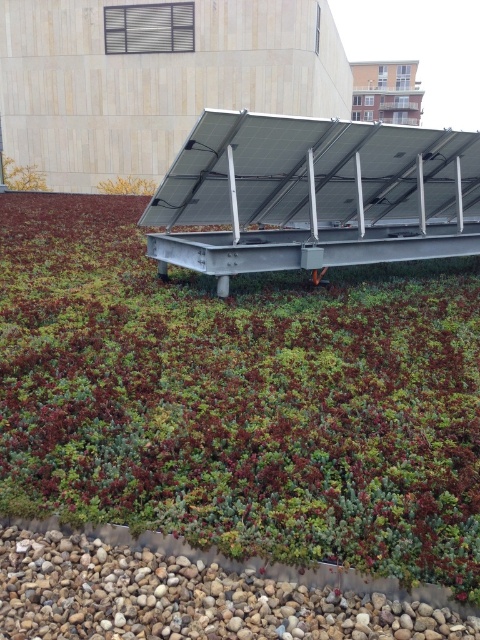
Between green succulent at center and transparent glass solar panel at upper center, which one is positioned higher?

transparent glass solar panel at upper center is above.

Measure the distance from green succulent at center to transparent glass solar panel at upper center.

4.81 feet

Between point (225, 538) and point (326, 168), which one is positioned behind?

Positioned behind is point (326, 168).

Where is `green succulent at center`? green succulent at center is located at coordinates (240, 397).

Can you confirm if green succulent at center is positioned to the left of yellow leafy plant at upper left?

In fact, green succulent at center is to the right of yellow leafy plant at upper left.

Who is more distant from viewer, (336,397) or (106,188)?

The point (106,188) is more distant.

Who is more forward, (147, 413) or (107, 186)?

Positioned in front is point (147, 413).

Find the location of `green succulent at center`. green succulent at center is located at coordinates (240, 397).

Does transparent glass solar panel at upper center have a smaller size compared to yellow leafy plant at upper left?

Yes, transparent glass solar panel at upper center is smaller than yellow leafy plant at upper left.

Can you confirm if transparent glass solar panel at upper center is shorter than yellow leafy plant at upper left?

Yes, transparent glass solar panel at upper center is shorter than yellow leafy plant at upper left.

Between point (435, 205) and point (103, 180), which one is positioned in front?

Point (435, 205) is in front.

Locate an element on the screen. The width and height of the screenshot is (480, 640). transparent glass solar panel at upper center is located at coordinates 315,173.